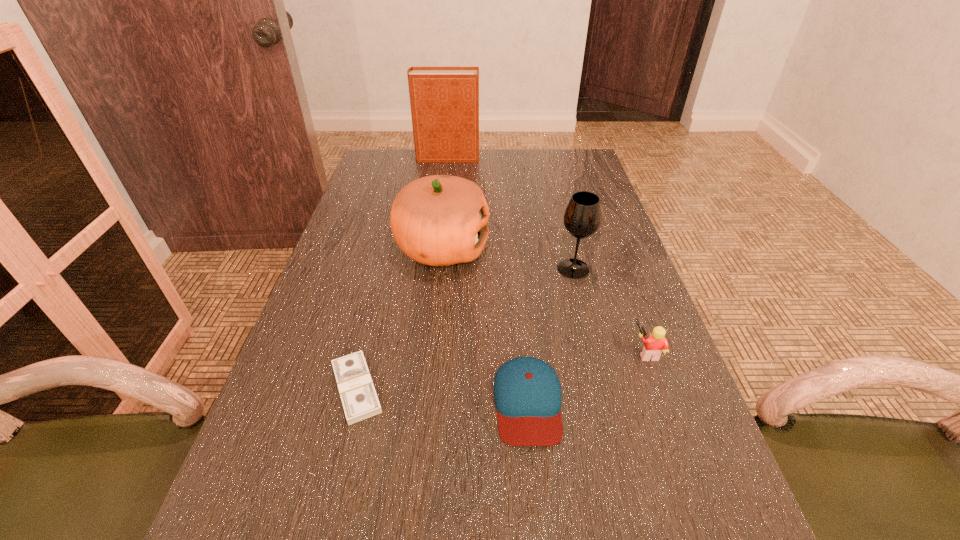
You are a GUI agent. You are given a task and a screenshot of the screen. Output one action in this format:
    pyautogui.click(x=<x>, y=<y>)
    Task: Click on the unoccupied area between the shortest object and the farthest object
    The image size is (960, 540).
    Given the screenshot: What is the action you would take?
    pyautogui.click(x=402, y=273)

At what (x,y) coordinates should I click in order to perform the action: click on vacant space in between the pumpkin and the shortest object. Please return your answer as a coordinate pair (x, y). Image resolution: width=960 pixels, height=540 pixels. Looking at the image, I should click on (399, 318).

You are a GUI agent. You are given a task and a screenshot of the screen. Output one action in this format:
    pyautogui.click(x=<x>, y=<y>)
    Task: Click on the free space between the wineglass and the second shortest object
    
    Given the screenshot: What is the action you would take?
    pyautogui.click(x=551, y=335)

This screenshot has height=540, width=960. I want to click on free spot between the fifth tallest object and the dollar, so click(x=443, y=395).

Identify the location of free space between the fifth object from left to right and the fifth tallest object. (551, 335).

The image size is (960, 540). What are the coordinates of `empty location between the tallest object and the second shortest object` in the screenshot? It's located at (488, 280).

Select which object is the closest to the baseball cap. Please provide its 2D coordinates. Your answer should be formatted as a tuple, i.e. [(x, y)], where the tuple contains the x and y coordinates of a point satisfying the conditions above.

[(656, 342)]

Select which object appears as the second closest to the farthest object. Please provide its 2D coordinates. Your answer should be formatted as a tuple, i.e. [(x, y)], where the tuple contains the x and y coordinates of a point satisfying the conditions above.

[(582, 217)]

At what (x,y) coordinates should I click in order to perform the action: click on vacant space that satisfies the following two spatial constraints: 1. on the open cover of the hardback book; 2. on the back side of the second object from right to left. Please return your answer as a coordinate pair (x, y). This screenshot has width=960, height=540. Looking at the image, I should click on (434, 268).

This screenshot has height=540, width=960. I want to click on vacant space that satisfies the following two spatial constraints: 1. on the open cover of the farthest object; 2. on the front side of the shortest object, so click(419, 388).